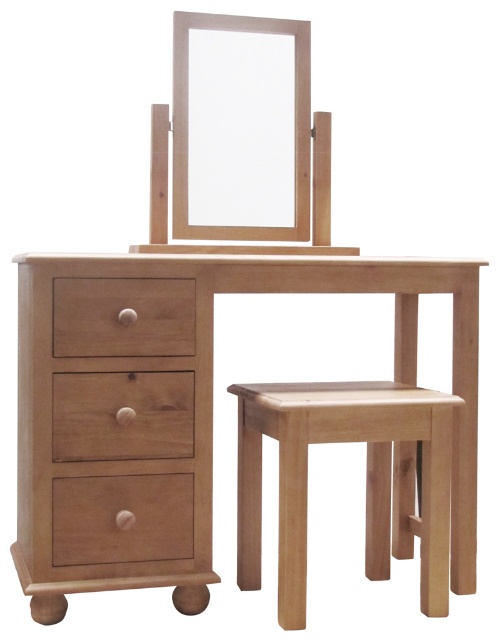
Who is shorter, natural wood table at center or matte wood drawer at center?

With less height is matte wood drawer at center.

Can you confirm if natural wood table at center is bigger than matte wood drawer at center?

Indeed, natural wood table at center has a larger size compared to matte wood drawer at center.

Where is `natural wood table at center`? The height and width of the screenshot is (640, 498). natural wood table at center is located at coordinates (178, 408).

How much distance is there between matte wood drawer at lower left and matte wood drawer at center?

The distance of matte wood drawer at lower left from matte wood drawer at center is 14.33 inches.

Is matte wood drawer at lower left to the left of matte wood drawer at center from the viewer's perspective?

Yes, matte wood drawer at lower left is to the left of matte wood drawer at center.

Is point (121, 554) more distant than point (55, 308)?

Yes.

Where is `matte wood drawer at lower left`? matte wood drawer at lower left is located at coordinates (122, 518).

Does natural wood stool at lower right have a larger size compared to matte wood drawer at center?

Correct, natural wood stool at lower right is larger in size than matte wood drawer at center.

Can you confirm if natural wood stool at lower right is positioned to the left of matte wood drawer at center?

No, natural wood stool at lower right is not to the left of matte wood drawer at center.

Identify the location of natural wood stool at lower right. (366, 481).